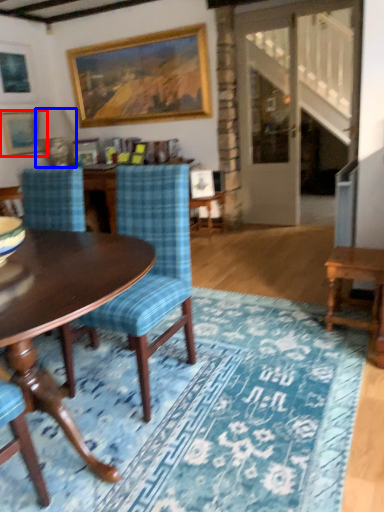
Question: Which point is closer to the camera, picture frame (highlighted by a red box) or lamp (highlighted by a blue box)?

Choices:
 (A) picture frame
 (B) lamp

Answer: (B)